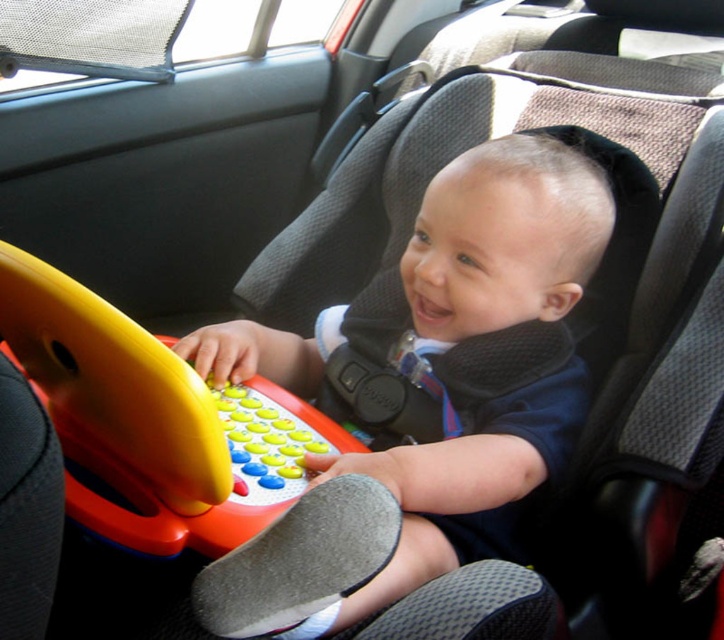
Question: Is matte plastic toy at center closer to the viewer compared to rubberized plastic toy at center?

Choices:
 (A) no
 (B) yes

Answer: (B)

Question: Which object is farther from the camera taking this photo?

Choices:
 (A) matte plastic toy at center
 (B) rubberized plastic toy at center

Answer: (B)

Question: Does matte plastic toy at center appear over rubberized plastic toy at center?

Choices:
 (A) no
 (B) yes

Answer: (B)

Question: Can you confirm if matte plastic toy at center is positioned below rubberized plastic toy at center?

Choices:
 (A) yes
 (B) no

Answer: (B)